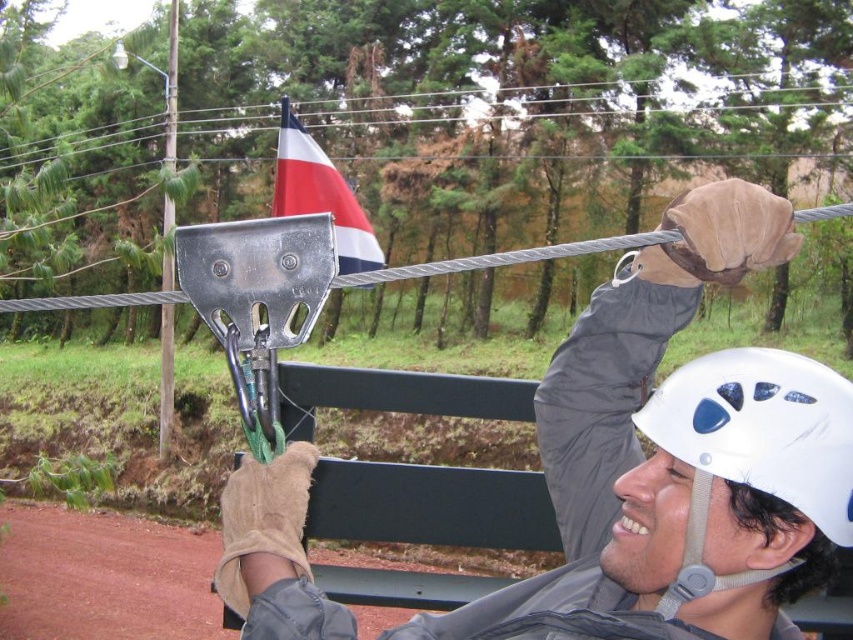
Question: Among these points, which one is nearest to the camera?

Choices:
 (A) (840, 396)
 (B) (361, 244)
 (C) (490, 627)

Answer: (A)

Question: Based on their relative distances, which object is nearer to the metallic gray helmet at upper center?

Choices:
 (A) white matte helmet at upper right
 (B) red-white-blue fabric flag at upper center

Answer: (A)

Question: Can you confirm if metallic gray helmet at upper center is positioned above white matte helmet at upper right?

Choices:
 (A) no
 (B) yes

Answer: (A)

Question: Does metallic gray helmet at upper center have a smaller size compared to white matte helmet at upper right?

Choices:
 (A) yes
 (B) no

Answer: (B)

Question: Does white matte helmet at upper right appear over red-white-blue fabric flag at upper center?

Choices:
 (A) no
 (B) yes

Answer: (A)

Question: Which point is closer to the camera?

Choices:
 (A) metallic gray helmet at upper center
 (B) white matte helmet at upper right

Answer: (A)